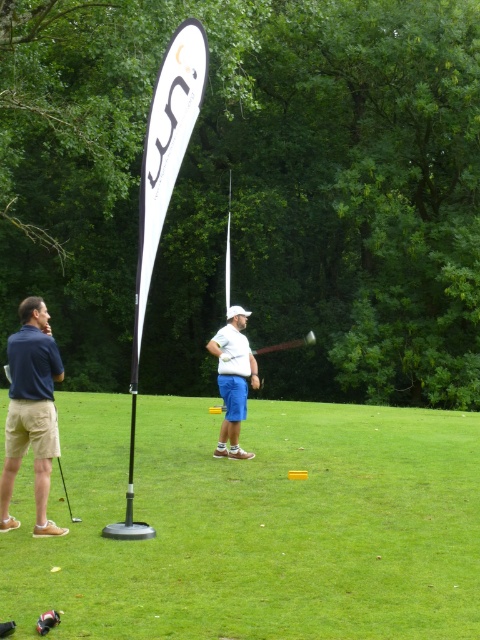
You are a golfer who wants to place a new flag at the exact location where the white matte golf club at center is currently positioned. Given that the flag is 1.5 meters tall, will it be visible over the grass? Please explain your reasoning.

The white matte golf club at center is positioned at point (233, 380). Since golf clubs are typically around 1 meter in length and the flag is 1.5 meters tall, the flag will be taller than the golf club and thus visible over the grass.

You are a golf instructor observing a student holding a white matte golf club at center and a wooden shaft at center. Which club should the student choose for a more accurate swing, and why?

The student should choose the white matte golf club at center because it is thinner than the wooden shaft at center, providing better control during the swing.